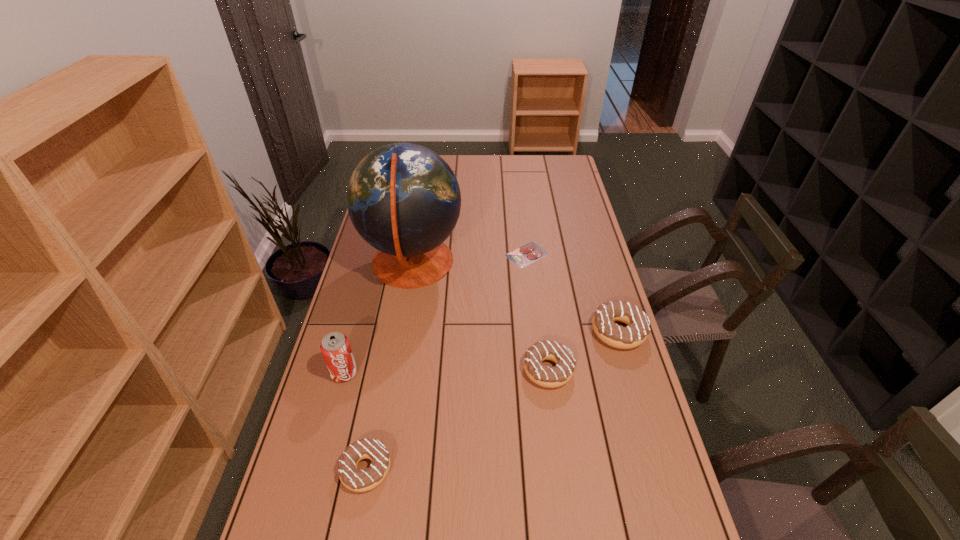
Find the location of `empty space between the rightmost object and the nearest object`. empty space between the rightmost object and the nearest object is located at coordinates (492, 400).

Where is `free area in between the shortest object and the tallest object`? free area in between the shortest object and the tallest object is located at coordinates (469, 259).

In order to click on unoccupied area between the rightmost doughnut and the shortest object in this screenshot , I will do `click(572, 293)`.

Identify which object is the third nearest to the fifth tallest object. Please provide its 2D coordinates. Your answer should be formatted as a tuple, i.e. [(x, y)], where the tuple contains the x and y coordinates of a point satisfying the conditions above.

[(403, 199)]

At what (x,y) coordinates should I click in order to perform the action: click on object identified as the fourth closest to the salami. Please return your answer as a coordinate pair (x, y). The image size is (960, 540). Looking at the image, I should click on (335, 347).

I want to click on doughnut that stands as the closest to the globe, so click(x=551, y=377).

Find the location of `the closest doughnut to the shortest doughnut`. the closest doughnut to the shortest doughnut is located at coordinates (551, 377).

You are a GUI agent. You are given a task and a screenshot of the screen. Output one action in this format:
    pyautogui.click(x=<x>, y=<y>)
    Task: Click on the vacant space that satisfies the following two spatial constraints: 1. on the back side of the rightmost doughnut; 2. on the left side of the soda can
    The height and width of the screenshot is (540, 960).
    Given the screenshot: What is the action you would take?
    pyautogui.click(x=355, y=332)

Image resolution: width=960 pixels, height=540 pixels. In order to click on free location that satisfies the following two spatial constraints: 1. on the back side of the second shortest doughnut; 2. with the Americas facing the viewer on the tallest object in this screenshot , I will do `click(534, 264)`.

Locate an element on the screen. Image resolution: width=960 pixels, height=540 pixels. vacant area that satisfies the following two spatial constraints: 1. with the Americas facing the viewer on the globe; 2. on the right side of the rightmost object is located at coordinates (401, 332).